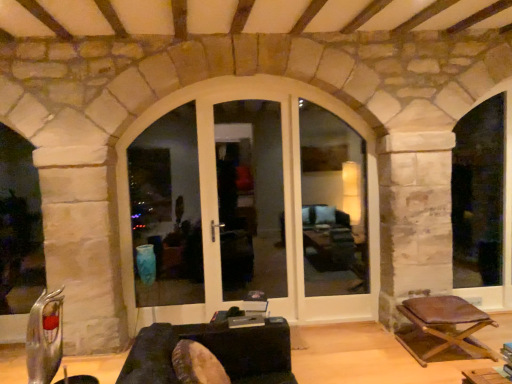
Question: In the image, is white glass door at center positioned in front of or behind brown leather stool at lower right?

Choices:
 (A) front
 (B) behind

Answer: (B)

Question: From a real-world perspective, is white glass door at center above or below brown leather stool at lower right?

Choices:
 (A) below
 (B) above

Answer: (B)

Question: Based on their relative distances, which object is nearer to the white glossy door at center?

Choices:
 (A) white glass door at center
 (B) white wood window frame at right, the third window frame positioned from the left
 (C) white glossy door at center, the 3th window frame viewed from the right
 (D) white glass window at center, arranged as the 2th window frame when viewed from the left
 (E) dark brown leather couch at center

Answer: (C)

Question: Which object is positioned closest to the white glossy door at center?

Choices:
 (A) white wood window frame at right, positioned as the 1th window frame in right-to-left order
 (B) white glossy door at center, the 3th window frame viewed from the right
 (C) white glass window at center, arranged as the second window frame when viewed from the right
 (D) white glass door at center
 (E) dark brown leather couch at center

Answer: (B)